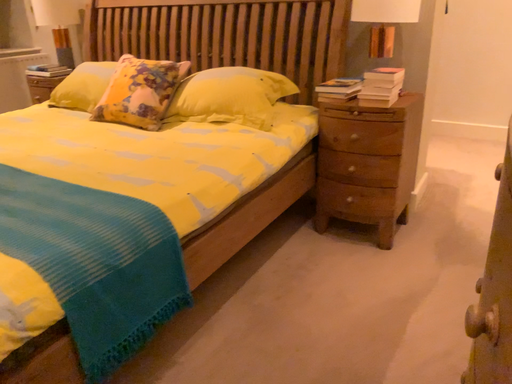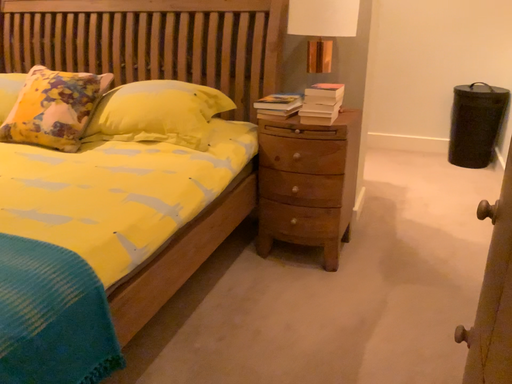
Question: How did the camera likely rotate when shooting the video?

Choices:
 (A) rotated left
 (B) rotated right

Answer: (B)